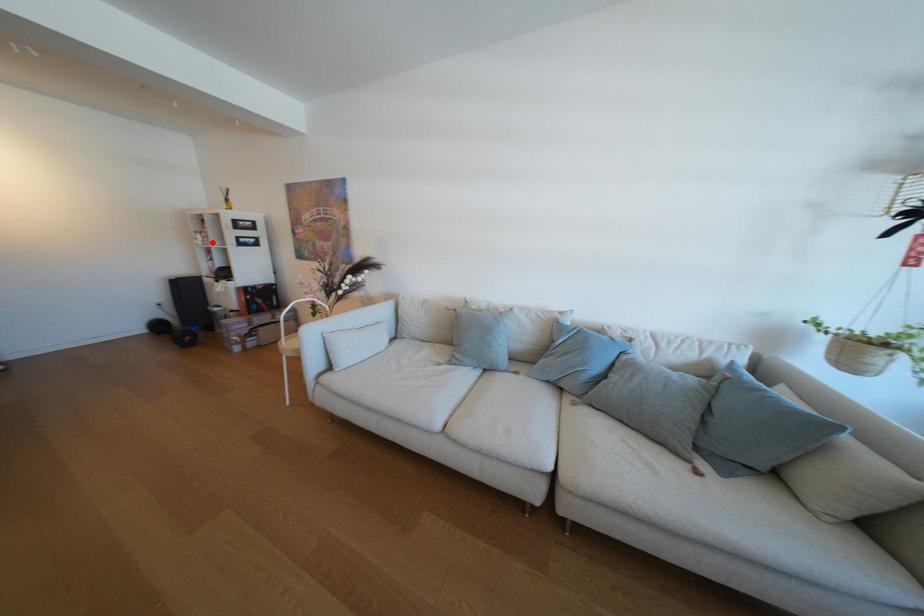
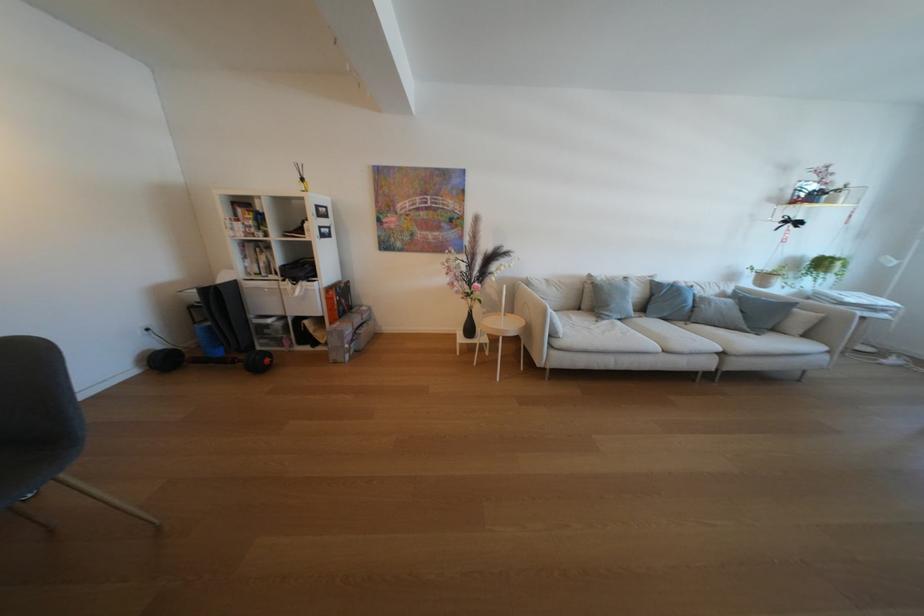
Locate, in the second image, the point that corresponds to the highlighted location in the first image.

(256, 233)